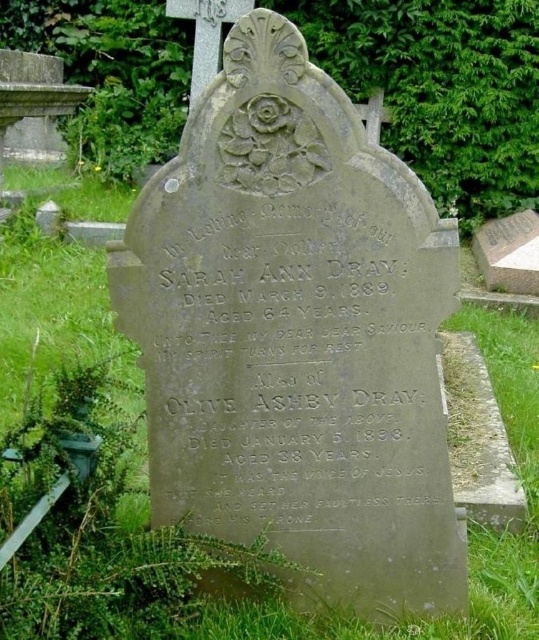
Question: Which object is farther from the camera taking this photo?

Choices:
 (A) green grass at center
 (B) gray stone inscription at center

Answer: (A)

Question: Which point is farther to the camera?

Choices:
 (A) gray stone inscription at center
 (B) green grass at center

Answer: (B)

Question: Can you confirm if gray stone inscription at center is smaller than green grass at center?

Choices:
 (A) no
 (B) yes

Answer: (B)

Question: Is gray stone inscription at center behind green grass at center?

Choices:
 (A) yes
 (B) no

Answer: (B)

Question: Can you confirm if gray stone inscription at center is positioned to the right of green grass at center?

Choices:
 (A) yes
 (B) no

Answer: (A)

Question: Which point is closer to the camera taking this photo?

Choices:
 (A) (162, 333)
 (B) (473, 588)

Answer: (A)